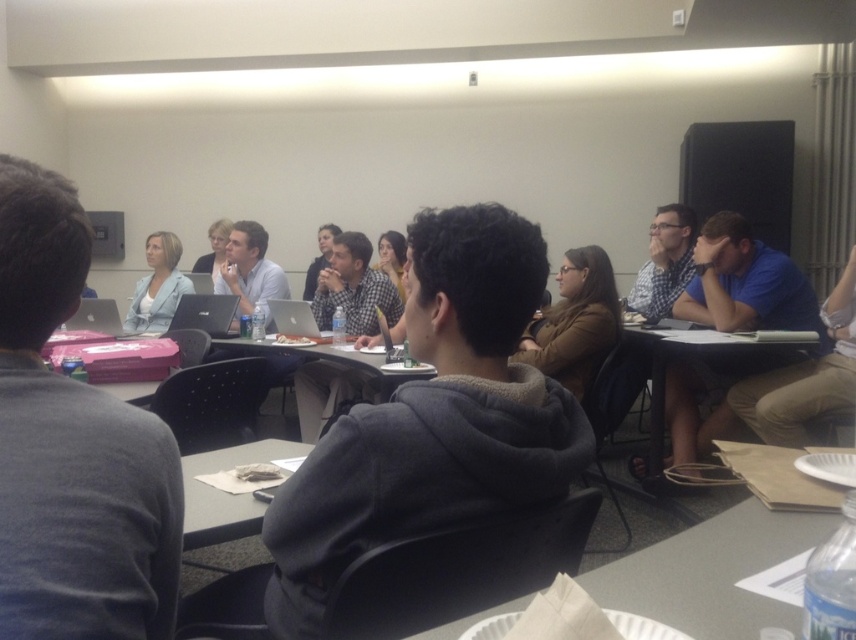
Can you confirm if white paper at center is positioned below light brown hair at center?

Yes, white paper at center is below light brown hair at center.

Between point (269, 440) and point (403, 250), which one is positioned in front?

Point (269, 440) is in front.

The height and width of the screenshot is (640, 856). Identify the location of white paper at center. (226, 492).

Which is more to the left, light blue blazer at upper left or blue cotton shirt at center?

Positioned to the left is light blue blazer at upper left.

Is point (100, 554) positioned before point (847, 259)?

Yes, it is in front of point (847, 259).

Is point (66, 592) farther from viewer compared to point (765, 397)?

That is False.

The height and width of the screenshot is (640, 856). Identify the location of light blue blazer at upper left. (72, 449).

Who is more distant from viewer, (409, 381) or (770, 358)?

The point (770, 358) is more distant.

Who is more forward, (434,404) or (738,212)?

Point (434,404) is more forward.

Identify the location of gray fleece hoodie at center. This screenshot has height=640, width=856. (432, 419).